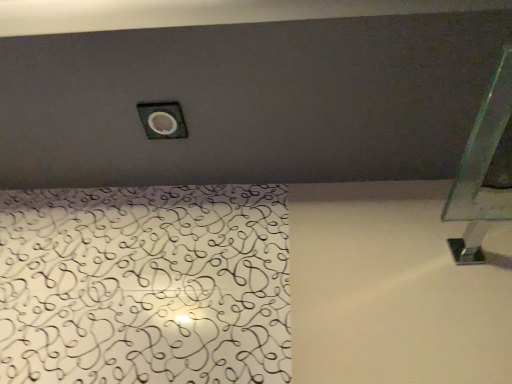
You are a GUI agent. You are given a task and a screenshot of the screen. Output one action in this format:
    pyautogui.click(x=<x>, y=<y>)
    Task: Click on the vacant area on top of matte gray wall at upper center (from a real-world perspective)
    This screenshot has height=384, width=512.
    Given the screenshot: What is the action you would take?
    pyautogui.click(x=221, y=85)